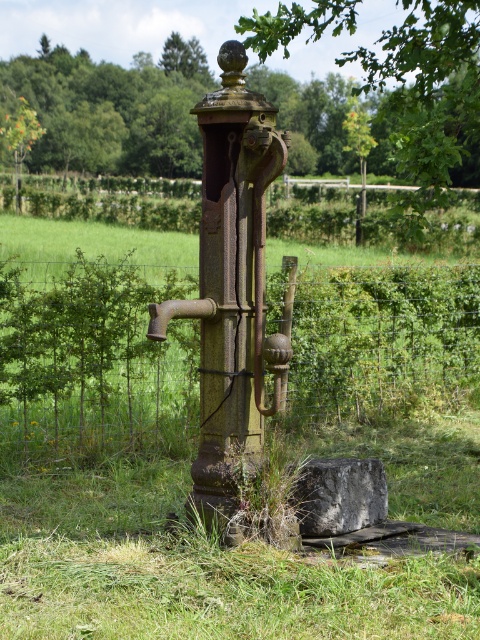
Question: Is wire mesh fence at center below green leafy tree at upper center?

Choices:
 (A) yes
 (B) no

Answer: (A)

Question: Which of the following is the closest to the observer?

Choices:
 (A) (451, 362)
 (B) (383, 81)

Answer: (B)

Question: Does wire mesh fence at center appear under green leafy tree at upper center?

Choices:
 (A) no
 (B) yes

Answer: (B)

Question: Which object is closer to the camera taking this photo?

Choices:
 (A) wire mesh fence at center
 (B) green leafy tree at upper center

Answer: (B)

Question: Can you confirm if wire mesh fence at center is wider than green leafy tree at upper center?

Choices:
 (A) yes
 (B) no

Answer: (B)